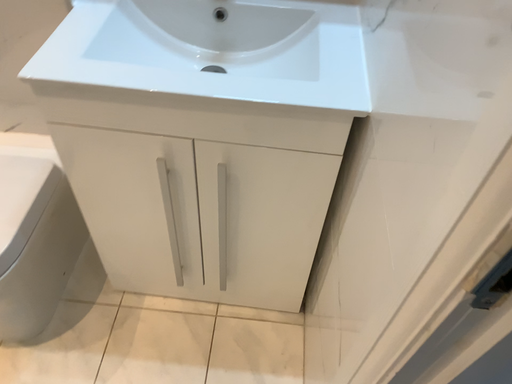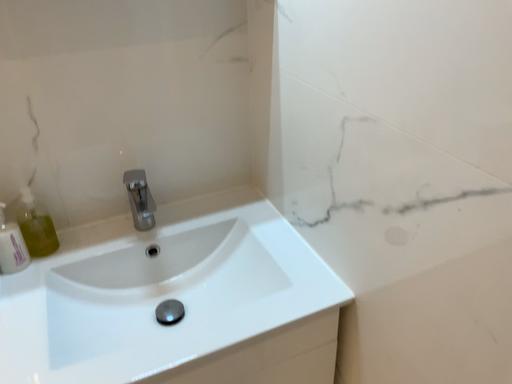
Question: How did the camera likely rotate when shooting the video?

Choices:
 (A) rotated downward
 (B) rotated upward

Answer: (B)